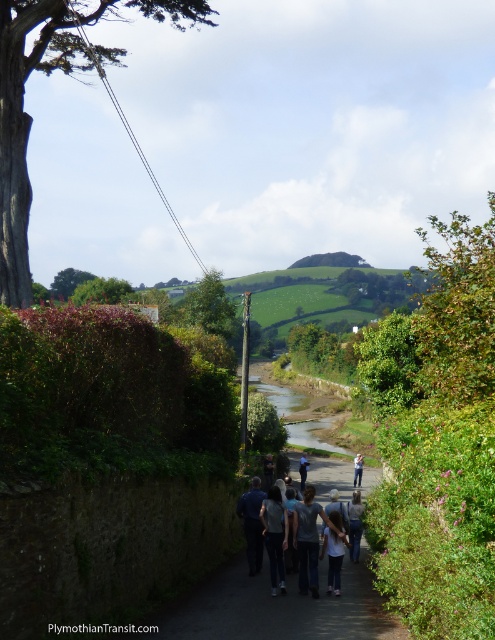
Does point (336, 522) come behind point (359, 481)?

No, it is not.

Between denim jeans at center and light blue denim jeans at center, which one has less height?

With less height is denim jeans at center.

Where is `denim jeans at center`? Image resolution: width=495 pixels, height=640 pixels. denim jeans at center is located at coordinates (334, 557).

Find the location of a particular element. This screenshot has width=495, height=640. denim jeans at center is located at coordinates (334, 557).

Is the position of dark gray shirt at center less distant than that of denim jeans at center?

Yes, dark gray shirt at center is closer to the viewer.

Which of these two, dark gray shirt at center or denim jeans at center, stands shorter?

With less height is denim jeans at center.

What do you see at coordinates (314, 540) in the screenshot? This screenshot has height=640, width=495. I see `dark gray shirt at center` at bounding box center [314, 540].

You are a GUI agent. You are given a task and a screenshot of the screen. Output one action in this format:
    pyautogui.click(x=<x>, y=<y>)
    Task: Click on the dark gray shirt at center
    The image size is (495, 640).
    Given the screenshot: What is the action you would take?
    pyautogui.click(x=314, y=540)

Looking at this image, does dark gray shirt at center appear on the right side of light gray cotton shirt at center?

In fact, dark gray shirt at center is to the left of light gray cotton shirt at center.

Who is positioned more to the left, dark gray shirt at center or light gray cotton shirt at center?

dark gray shirt at center

Which is behind, point (308, 576) or point (300, 467)?

The point (300, 467) is more distant.

Where is `dark gray shirt at center`? dark gray shirt at center is located at coordinates coord(314,540).